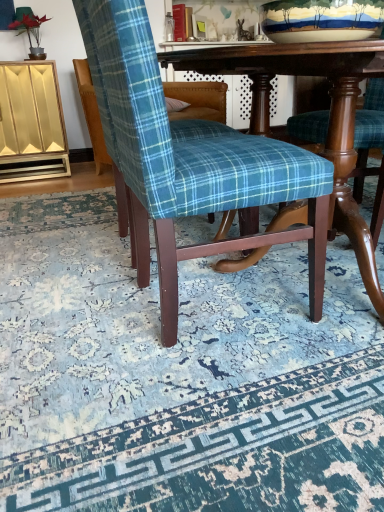
Question: From a real-world perspective, is blue plaid fabric chair at center, the first chair positioned from the front, physically below matte gold cabinet at left?

Choices:
 (A) yes
 (B) no

Answer: (B)

Question: Is blue plaid fabric chair at center, which is the 2th chair in back-to-front order, at the right side of matte gold cabinet at left?

Choices:
 (A) no
 (B) yes

Answer: (B)

Question: Considering the relative sizes of blue plaid fabric chair at center, the first chair positioned from the front, and matte gold cabinet at left in the image provided, is blue plaid fabric chair at center, the first chair positioned from the front, shorter than matte gold cabinet at left?

Choices:
 (A) no
 (B) yes

Answer: (A)

Question: Is the surface of blue plaid fabric chair at center, which is the 2th chair in back-to-front order, in direct contact with matte gold cabinet at left?

Choices:
 (A) no
 (B) yes

Answer: (A)

Question: From a real-world perspective, does blue plaid fabric chair at center, the first chair positioned from the front, stand above matte gold cabinet at left?

Choices:
 (A) no
 (B) yes

Answer: (B)

Question: Is wooden table at center to the left or to the right of earthenware bowl at upper center in the image?

Choices:
 (A) right
 (B) left

Answer: (B)

Question: Does point (345, 131) appear closer or farther from the camera than point (352, 31)?

Choices:
 (A) farther
 (B) closer

Answer: (A)

Question: In terms of height, does wooden table at center look taller or shorter compared to earthenware bowl at upper center?

Choices:
 (A) tall
 (B) short

Answer: (A)

Question: Considering the positions of wooden table at center and earthenware bowl at upper center in the image, is wooden table at center wider or thinner than earthenware bowl at upper center?

Choices:
 (A) thin
 (B) wide

Answer: (B)

Question: Considering the relative positions of blue plaid fabric chair at center, placed as the first chair when sorted from back to front, and earthenware bowl at upper center in the image provided, is blue plaid fabric chair at center, placed as the first chair when sorted from back to front, to the left or to the right of earthenware bowl at upper center?

Choices:
 (A) right
 (B) left

Answer: (B)

Question: Considering the positions of blue plaid fabric chair at center, placed as the first chair when sorted from back to front, and earthenware bowl at upper center in the image, is blue plaid fabric chair at center, placed as the first chair when sorted from back to front, taller or shorter than earthenware bowl at upper center?

Choices:
 (A) tall
 (B) short

Answer: (A)

Question: In the image, is blue plaid fabric chair at center, acting as the 2th chair starting from the front, positioned in front of or behind earthenware bowl at upper center?

Choices:
 (A) behind
 (B) front

Answer: (A)

Question: From a real-world perspective, is blue plaid fabric chair at center, placed as the first chair when sorted from back to front, above or below earthenware bowl at upper center?

Choices:
 (A) above
 (B) below

Answer: (B)

Question: Looking at their shapes, would you say matte gold cabinet at left is wider or thinner than blue plaid fabric chair at center, placed as the first chair when sorted from back to front?

Choices:
 (A) wide
 (B) thin

Answer: (B)

Question: From a real-world perspective, is matte gold cabinet at left physically located above or below blue plaid fabric chair at center, placed as the first chair when sorted from back to front?

Choices:
 (A) above
 (B) below

Answer: (B)